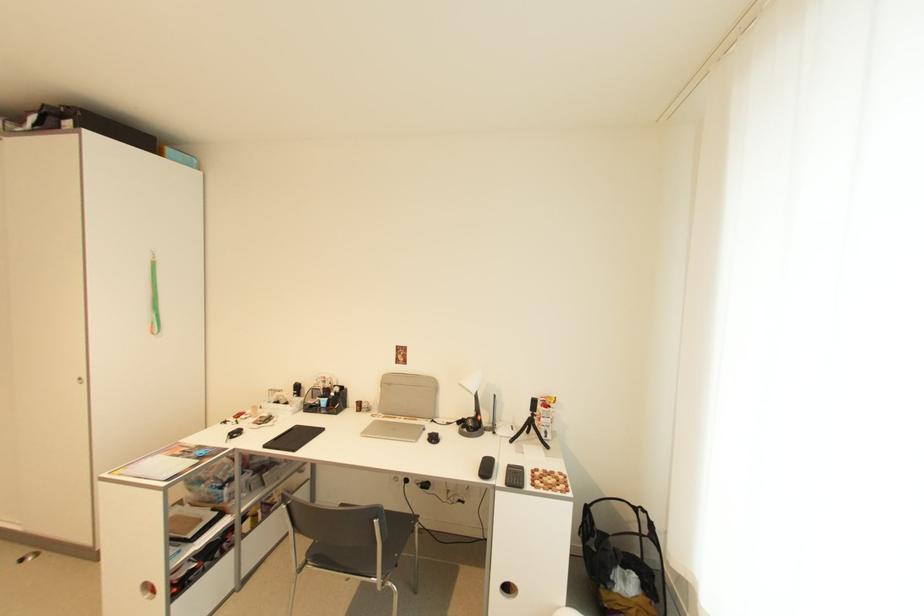
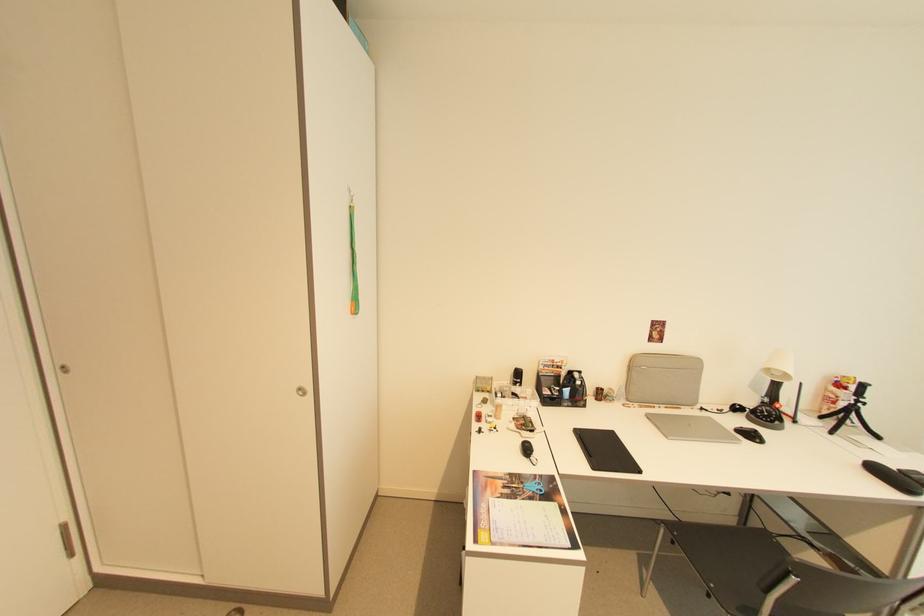
Find the pixel in the second image that matches point (393, 384) in the first image.

(638, 366)